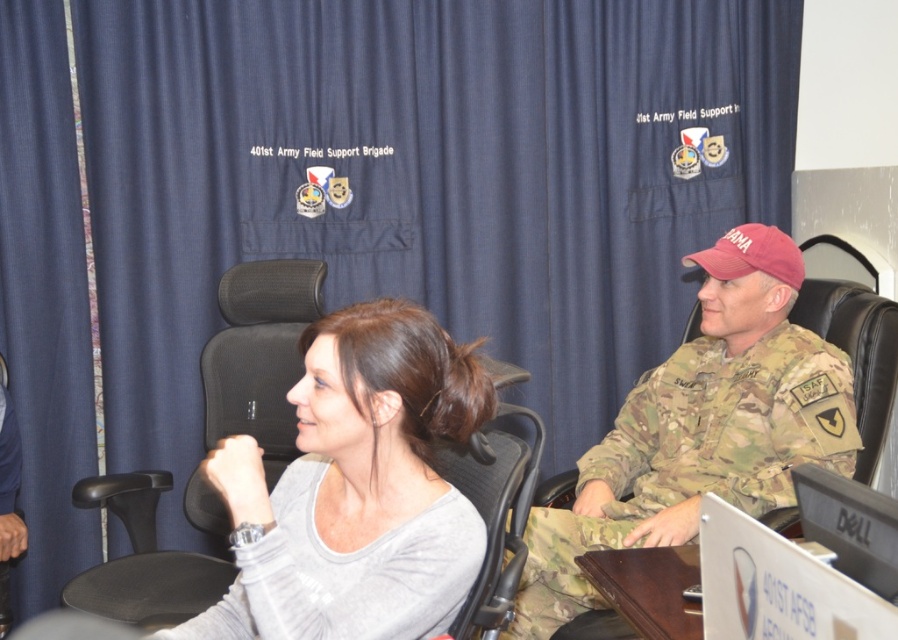
Is camouflage uniform at right to the right of black mesh chair at center from the viewer's perspective?

Correct, you'll find camouflage uniform at right to the right of black mesh chair at center.

Which is below, camouflage uniform at right or black mesh chair at center?

Positioned lower is black mesh chair at center.

Describe the element at coordinates (700, 428) in the screenshot. Image resolution: width=898 pixels, height=640 pixels. I see `camouflage uniform at right` at that location.

You are a GUI agent. You are given a task and a screenshot of the screen. Output one action in this format:
    pyautogui.click(x=<x>, y=<y>)
    Task: Click on the camouflage uniform at right
    This screenshot has width=898, height=640.
    Given the screenshot: What is the action you would take?
    pyautogui.click(x=700, y=428)

Between brown wood table at lower center and camouflage fabric uniform at center, which one is positioned higher?

camouflage fabric uniform at center is higher up.

Can you confirm if brown wood table at lower center is shorter than camouflage fabric uniform at center?

Yes, brown wood table at lower center is shorter than camouflage fabric uniform at center.

This screenshot has width=898, height=640. What are the coordinates of `brown wood table at lower center` in the screenshot? It's located at (648, 588).

Identify the location of brown wood table at lower center. click(x=648, y=588).

Can you confirm if camouflage uniform at right is positioned to the right of camouflage fabric uniform at center?

Correct, you'll find camouflage uniform at right to the right of camouflage fabric uniform at center.

Where is `camouflage uniform at right`? The height and width of the screenshot is (640, 898). camouflage uniform at right is located at coordinates (700, 428).